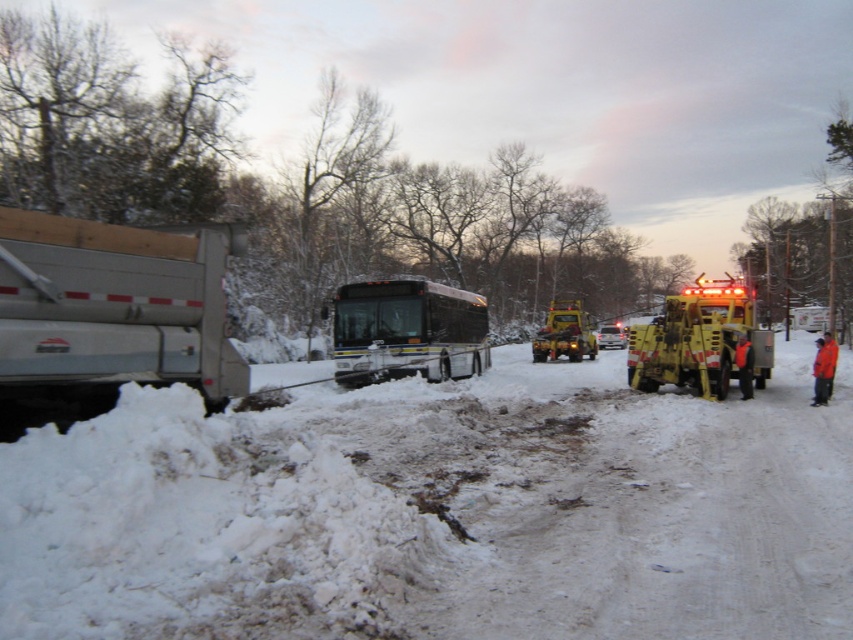
You are a delivery driver who needs to pass through the road where the black rubber bus at center and the yellow rubber snowplow at right are located. Considering their heights, which vehicle should you avoid driving under a low bridge ahead?

The black rubber bus at center has a greater height compared to the yellow rubber snowplow at right, so you should avoid driving the black rubber bus at center under the low bridge ahead.

You are standing at the roadside and see the silver metallic dump truck at left. If you want to cross the road to reach the bus in the center, will you have enough time if the truck starts moving forward at 10 km per hour? Assume you walk at 5 km per hour.

The silver metallic dump truck at left is 5.74 meters away from you. To cross the road safely, you need to calculate the time it takes for you to reach the bus versus the truck. Walking at 5 km per hour, your speed is approximately 1.39 m per second. Assuming the road width is about 5.74 meters, it would take roughly 4.13 seconds to cross. The truck moving at 10 km per hour is 2.78 m per second. In 4.13 seconds, the truck would cover 11.5 meters. Since the truck is initially 5.74 meters away, it would reach

Consider the image. You are a delivery driver trying to navigate through the snowy road. You see the white powdery snow at lower left and the silver metallic dump truck at left. Which object is taller from your viewpoint?

The silver metallic dump truck at left is taller than the white powdery snow at lower left.